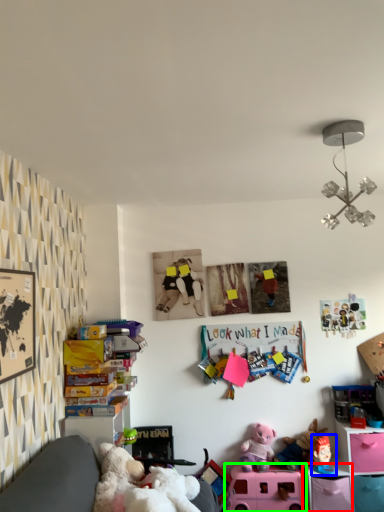
Question: Which object is positioned closest to shelf (highlighted by a red box)? Select from toy (highlighted by a blue box) and toy (highlighted by a green box).

Choices:
 (A) toy
 (B) toy

Answer: (A)